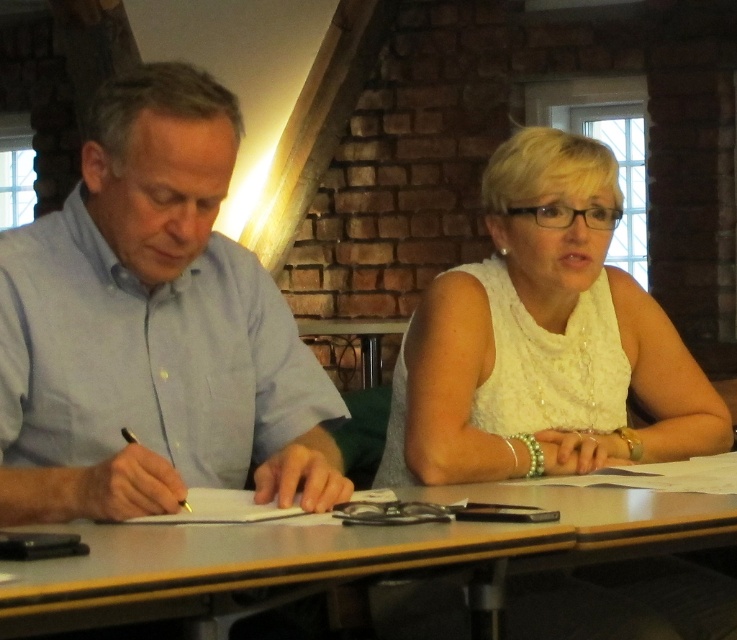
Question: Among these objects, which one is nearest to the camera?

Choices:
 (A) white lace dress at center
 (B) light blue shirt at left

Answer: (B)

Question: Does light blue shirt at left appear under smooth wooden table at center?

Choices:
 (A) no
 (B) yes

Answer: (A)

Question: Does white lace dress at center have a lesser width compared to smooth wooden table at center?

Choices:
 (A) no
 (B) yes

Answer: (B)

Question: Does light blue shirt at left appear under white lace dress at center?

Choices:
 (A) no
 (B) yes

Answer: (A)

Question: Which point is farther to the camera?

Choices:
 (A) (663, 602)
 (B) (83, 340)

Answer: (A)

Question: Considering the real-world distances, which object is closest to the smooth wooden table at center?

Choices:
 (A) white lace dress at center
 (B) light blue shirt at left

Answer: (B)